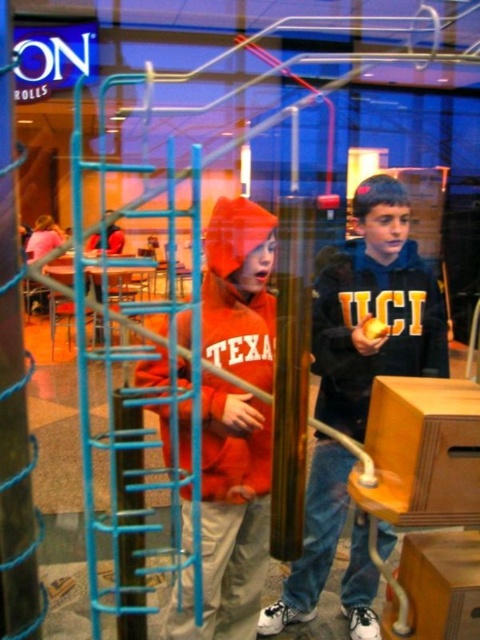
You are navigating through the shopping mall and need to reach the exit located at point B. You are currently at point A. The coordinates for point A are point (3, 17), and point B are point (225, 248). According to the image, which direction should you move to go from point A to point B?

Point (225, 248) is behind point (3, 17), so to reach point B from point A, you should move forward in the direction away from the entrance towards the back of the mall.

You are a parent trying to ensure your child can safely reach the lever on the wooden contraption. The orange fleece jacket at center is worn by a child who is 1.28 meters away from the lever. Is the distance sufficient for the child to safely interact with the lever?

The orange fleece jacket at center is 1.28 meters away from the lever. Whether this distance is safe depends on the child reaching out, but the distance itself is manageable for interaction.